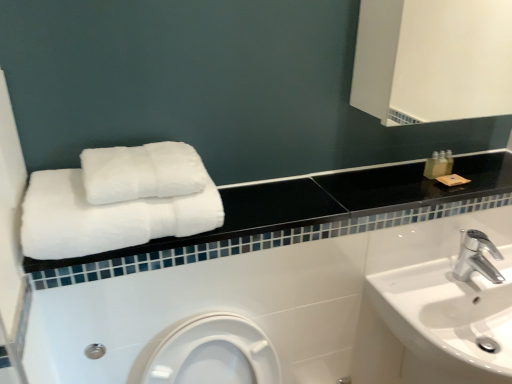
Locate an element on the screen. vacant area situated to the left side of silver metallic faucet at lower right is located at coordinates (420, 284).